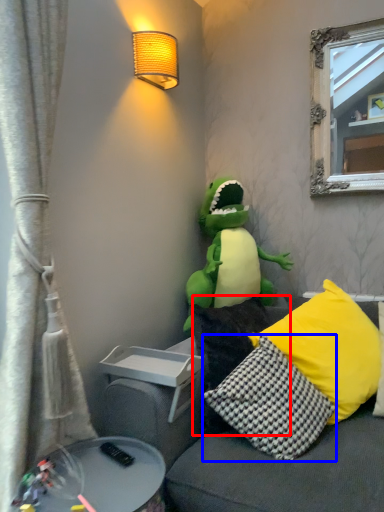
Question: Which point is further to the camera, pillow (highlighted by a red box) or pillow (highlighted by a blue box)?

Choices:
 (A) pillow
 (B) pillow

Answer: (A)